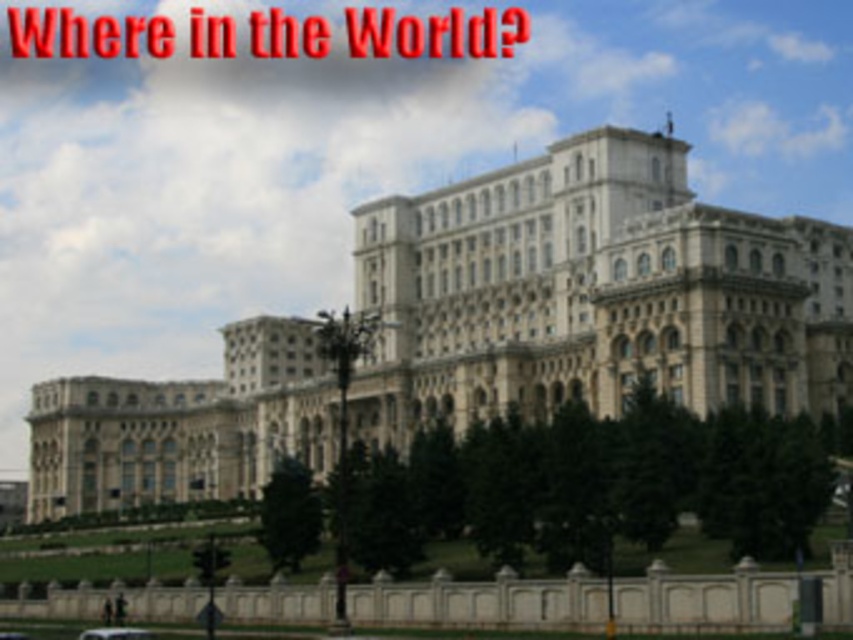
Is beige stone building at center in front of metallic silver car at lower center?

No, it is behind metallic silver car at lower center.

Based on the photo, who is shorter, beige stone building at center or metallic silver car at lower center?

Standing shorter between the two is metallic silver car at lower center.

Is point (525, 296) in front of point (103, 632)?

That is False.

The width and height of the screenshot is (853, 640). Find the location of `beige stone building at center`. beige stone building at center is located at coordinates (593, 292).

Which of these two, beige stone building at center or white matte car at lower left, stands shorter?

white matte car at lower left

Between beige stone building at center and white matte car at lower left, which one is positioned higher?

beige stone building at center is above.

Is point (815, 257) positioned in front of point (6, 637)?

No.

Identify the location of beige stone building at center. This screenshot has width=853, height=640. (593, 292).

Who is shorter, metallic silver car at lower center or white matte car at lower left?

With less height is white matte car at lower left.

Is point (91, 637) positioned after point (15, 637)?

No, it is in front of (15, 637).

Where is `metallic silver car at lower center`? The height and width of the screenshot is (640, 853). metallic silver car at lower center is located at coordinates (115, 634).